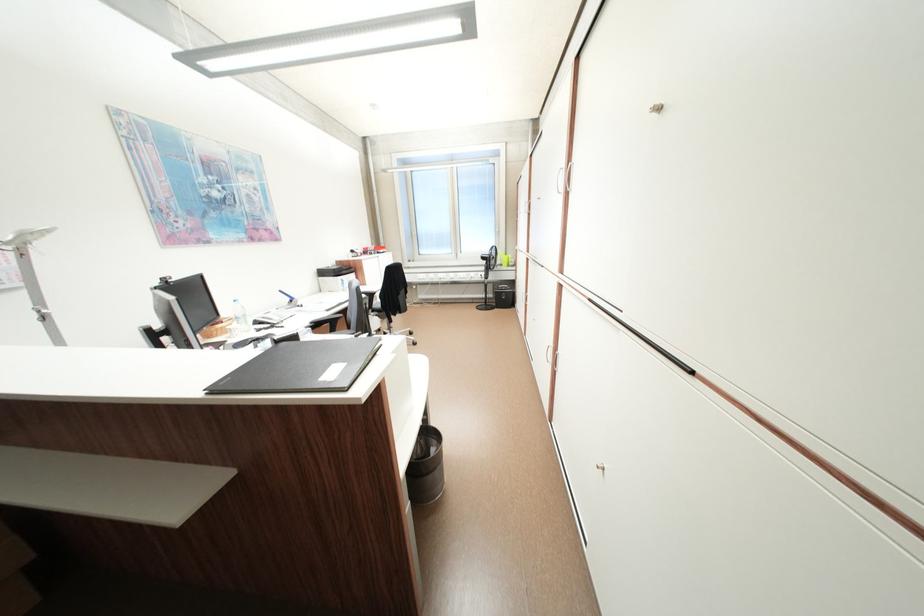
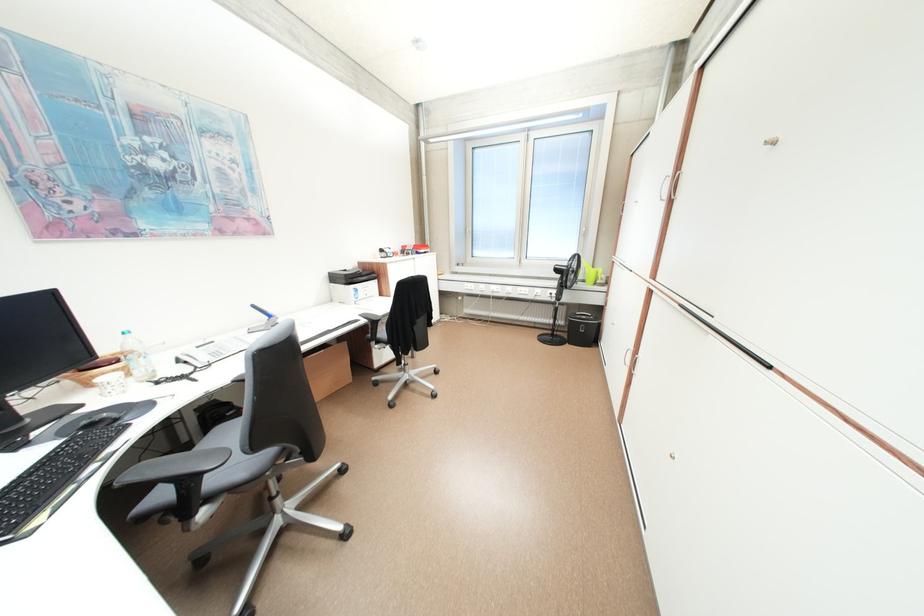
Where in the second image is the point corresponding to point 504,305 from the first image?

(576, 337)